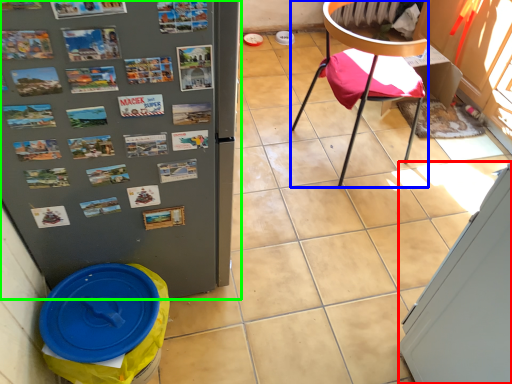
Question: Estimate the real-world distances between objects in this image. Which object is farther from screen door (highlighted by a red box), chair (highlighted by a blue box) or refrigerator (highlighted by a green box)?

Choices:
 (A) chair
 (B) refrigerator

Answer: (A)